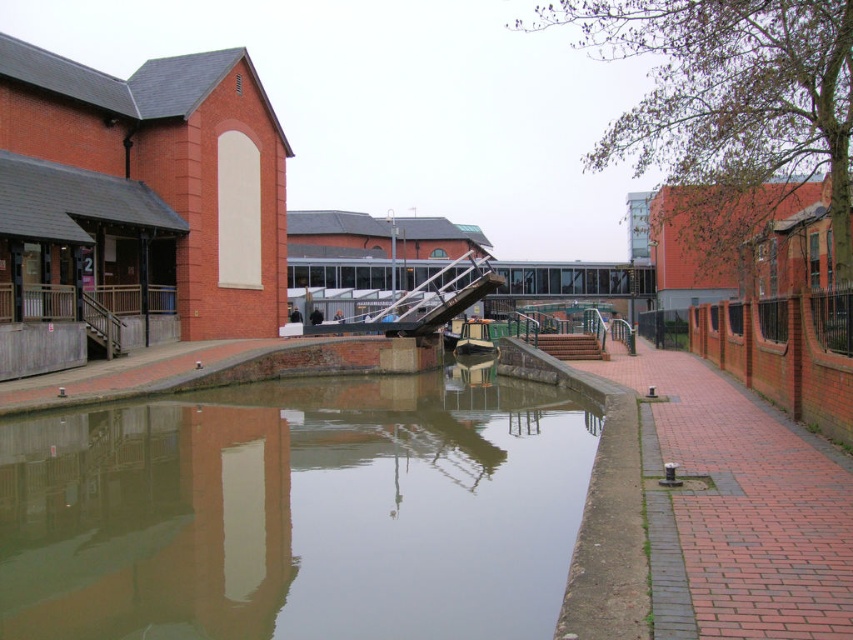
From the picture: You are standing on the paved walkway next to the canal. If you look straight ahead towards the center of the canal, what material do you see at the point marked as coordinates (297, 512)?

The point at coordinates (297, 512) is covered with smooth concrete water at center.

Based on the photo, you are standing on the walkway next to the canal and want to place a small potted plant between the smooth concrete water at center and the wooden boat at center. Based on their positions, which object should the plant be closer to?

The smooth concrete water at center is to the left of the wooden boat at center, so the plant should be placed closer to the wooden boat at center to be between them.

In the scene shown: You are standing on the paved walkway next to the canal. You want to step onto the smooth concrete water at center. Is this possible?

No, you cannot step onto the smooth concrete water at center because water is a liquid and cannot support your weight.